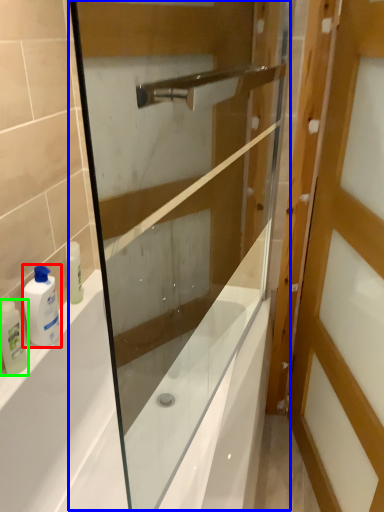
Question: Which is farther away from toiletry (highlighted by a red box)? screen door (highlighted by a blue box) or toiletry (highlighted by a green box)?

Choices:
 (A) screen door
 (B) toiletry

Answer: (A)